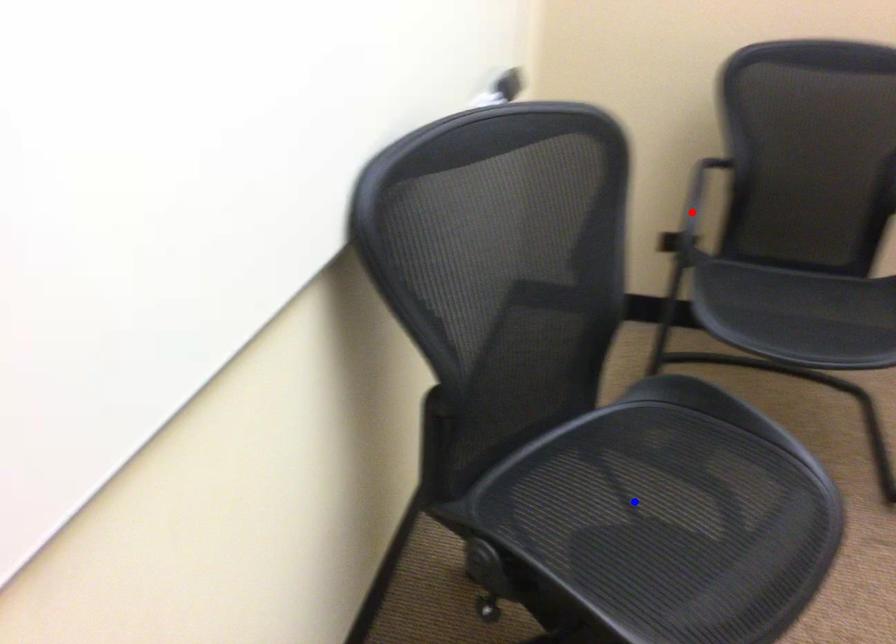
Question: Which of the two points in the image is closer to the camera?

Choices:
 (A) Blue point is closer.
 (B) Red point is closer.

Answer: (A)